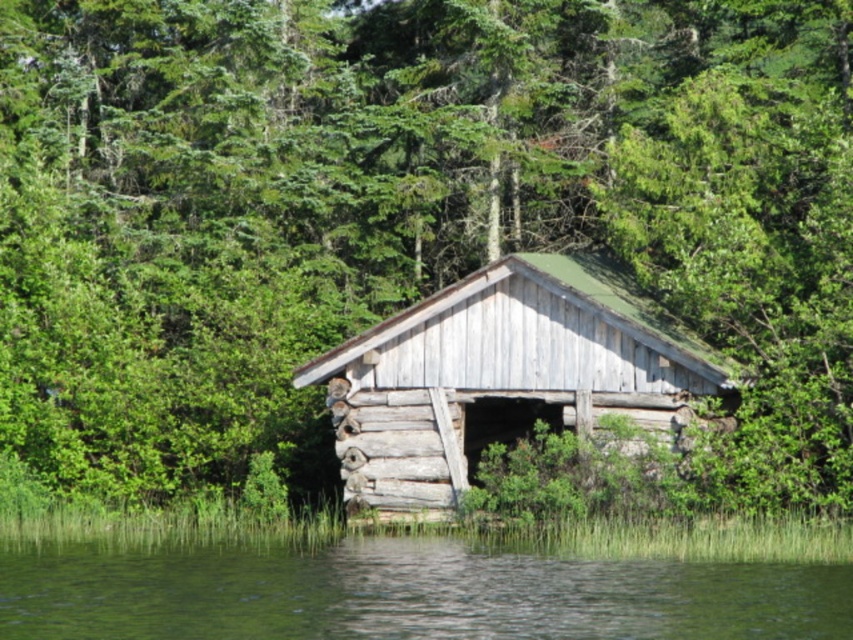
Does green liquid water at lower center have a larger size compared to weathered wood log cabin at center?

Correct, green liquid water at lower center is larger in size than weathered wood log cabin at center.

Which is behind, point (544, 577) or point (631, 413)?

Positioned behind is point (631, 413).

Which is behind, point (202, 632) or point (374, 468)?

Positioned behind is point (374, 468).

I want to click on green liquid water at lower center, so click(402, 593).